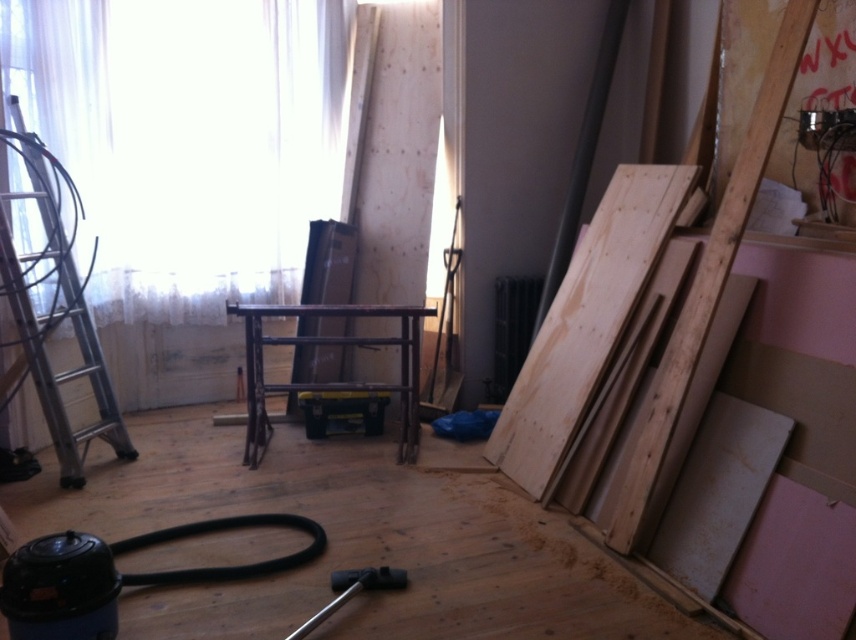
Question: Estimate the real-world distances between objects in this image. Which object is closer to the natural wood plywood at right?

Choices:
 (A) silver metallic ladder at left
 (B) white sheer curtain at upper left

Answer: (B)

Question: Which of the following is the closest to the observer?

Choices:
 (A) natural wood plywood at right
 (B) silver metallic ladder at left

Answer: (B)

Question: Can you confirm if white sheer curtain at upper left is positioned to the right of silver metallic ladder at left?

Choices:
 (A) no
 (B) yes

Answer: (B)

Question: Does white sheer curtain at upper left appear on the left side of natural wood plywood at right?

Choices:
 (A) no
 (B) yes

Answer: (B)

Question: Which object is positioned farthest from the natural wood plywood at right?

Choices:
 (A) white sheer curtain at upper left
 (B) silver metallic ladder at left

Answer: (B)

Question: Is white sheer curtain at upper left wider than natural wood plywood at right?

Choices:
 (A) no
 (B) yes

Answer: (B)